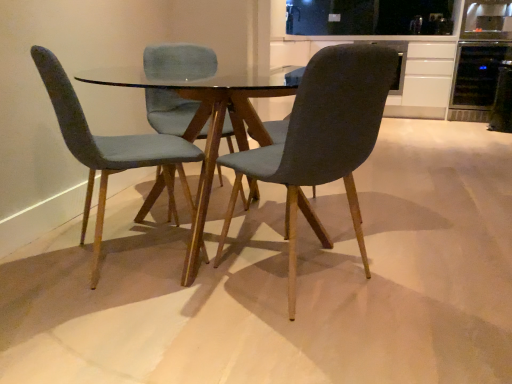
Where is `vacant area that is situated to the right of dark gray fabric chair at center, which is counted as the second chair, starting from the left`? vacant area that is situated to the right of dark gray fabric chair at center, which is counted as the second chair, starting from the left is located at coordinates (421, 283).